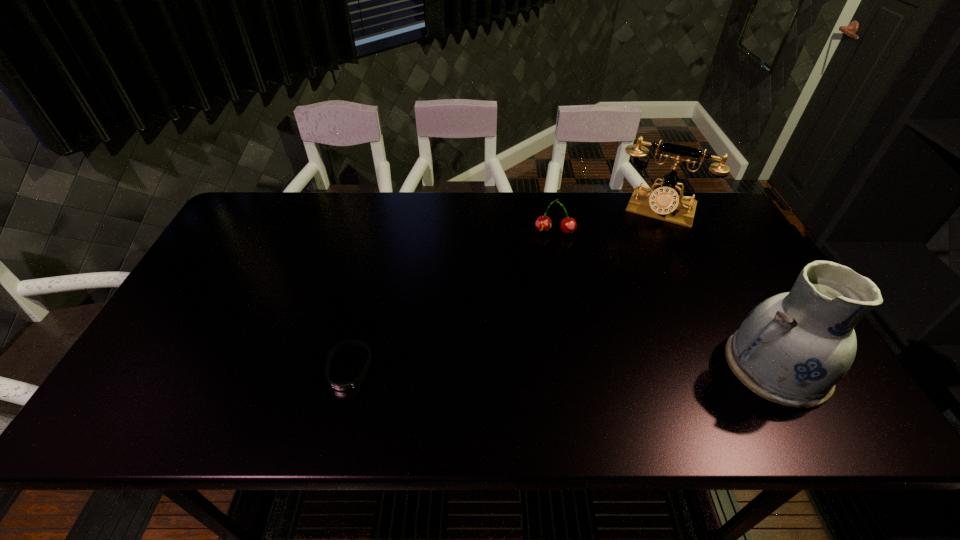
Locate an element on the screen. wristband is located at coordinates (x=341, y=386).

This screenshot has width=960, height=540. Find the location of `the leftmost object`. the leftmost object is located at coordinates (341, 386).

This screenshot has height=540, width=960. I want to click on pottery, so click(x=793, y=348).

Locate an element on the screen. The image size is (960, 540). cherry is located at coordinates [568, 225].

Where is `the second object from left to right`? The image size is (960, 540). the second object from left to right is located at coordinates (568, 225).

At what (x,y) coordinates should I click in order to perform the action: click on the third shortest object. Please return your answer as a coordinate pair (x, y). This screenshot has width=960, height=540. Looking at the image, I should click on (664, 203).

Locate an element on the screen. The image size is (960, 540). free space located on the left of the tallest object is located at coordinates click(672, 366).

Find the location of a particular element. The height and width of the screenshot is (540, 960). vacant space located with stems pointing upwards on the second object from left to right is located at coordinates (550, 328).

Where is `free space located with stems pointing upwards on the second object from left to right`? free space located with stems pointing upwards on the second object from left to right is located at coordinates (551, 310).

Where is `vacant space positioned 0.110m with stems pointing upwards on the second object from left to right`? vacant space positioned 0.110m with stems pointing upwards on the second object from left to right is located at coordinates (552, 261).